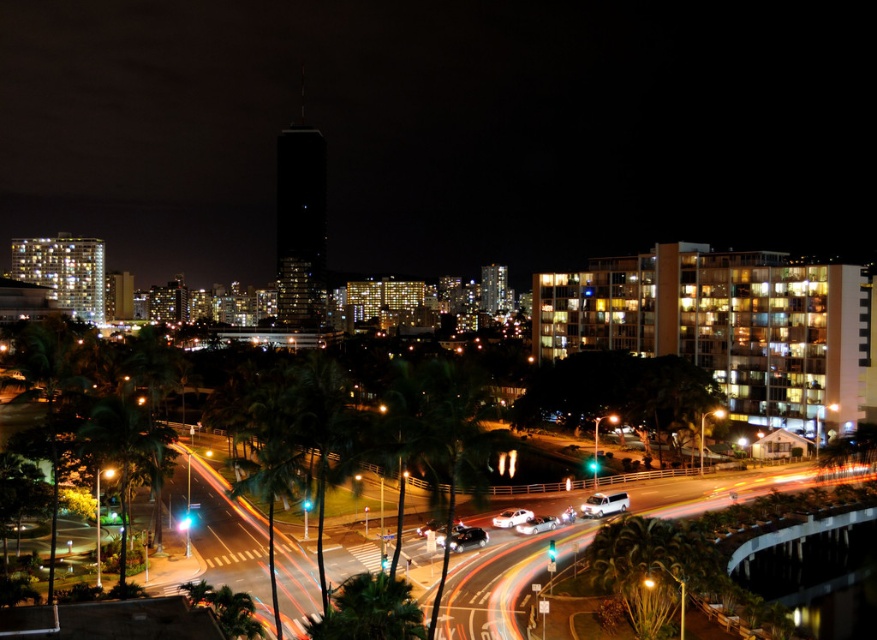
From the picture: Can you confirm if white matte van at lower center is wider than white glossy car at center?

Yes, white matte van at lower center is wider than white glossy car at center.

This screenshot has height=640, width=877. Describe the element at coordinates (604, 502) in the screenshot. I see `white matte van at lower center` at that location.

Locate an element on the screen. The height and width of the screenshot is (640, 877). white matte van at lower center is located at coordinates (604, 502).

Who is taller, green leafy palm tree at lower left or white matte van at lower center?

green leafy palm tree at lower left is taller.

Based on the photo, can you confirm if green leafy palm tree at lower left is shorter than white matte van at lower center?

No, green leafy palm tree at lower left is not shorter than white matte van at lower center.

Locate an element on the screen. This screenshot has height=640, width=877. green leafy palm tree at lower left is located at coordinates (123, 451).

Locate an element on the screen. This screenshot has width=877, height=640. green leafy palm tree at lower left is located at coordinates (123, 451).

Can you confirm if green leafy palm tree at lower left is shorter than white glossy car at center?

In fact, green leafy palm tree at lower left may be taller than white glossy car at center.

Is green leafy palm tree at lower left to the right of white glossy car at center from the viewer's perspective?

No, green leafy palm tree at lower left is not to the right of white glossy car at center.

Who is more distant from viewer, [139,433] or [512,520]?

Point [512,520]

The image size is (877, 640). Identify the location of green leafy palm tree at lower left. (123, 451).